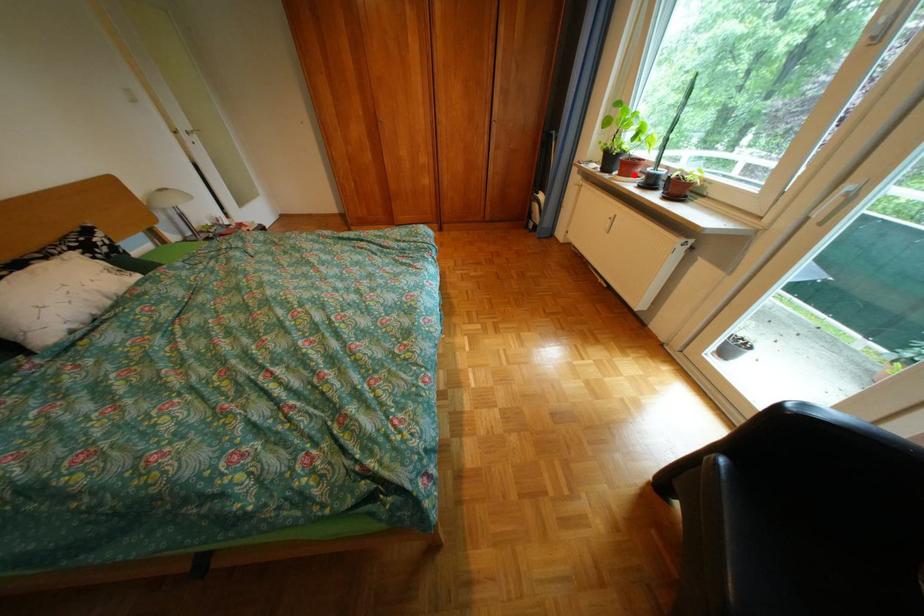
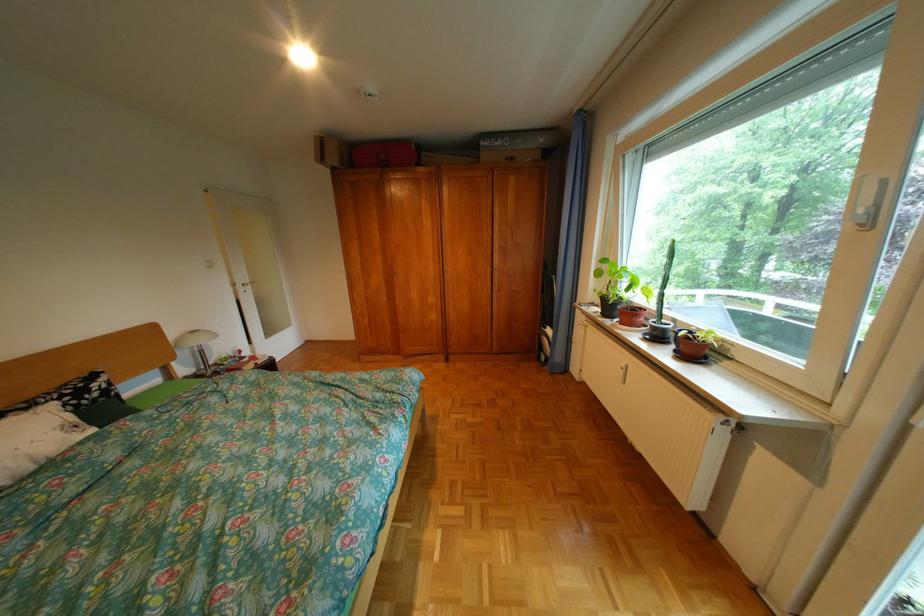
Locate, in the second image, the point that corresponds to the highlighted location in the first image.

(636, 323)